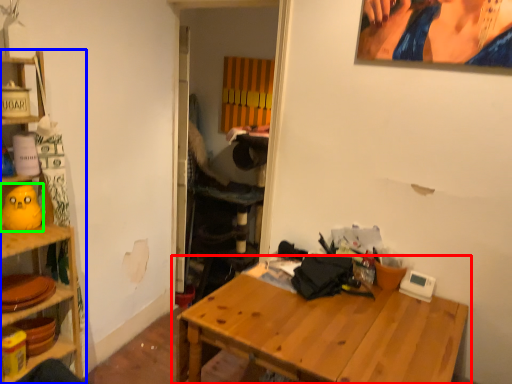
Question: Considering the real-world distances, which object is farthest from table (highlighted by a red box)? shelf (highlighted by a blue box) or toy (highlighted by a green box)?

Choices:
 (A) shelf
 (B) toy

Answer: (B)